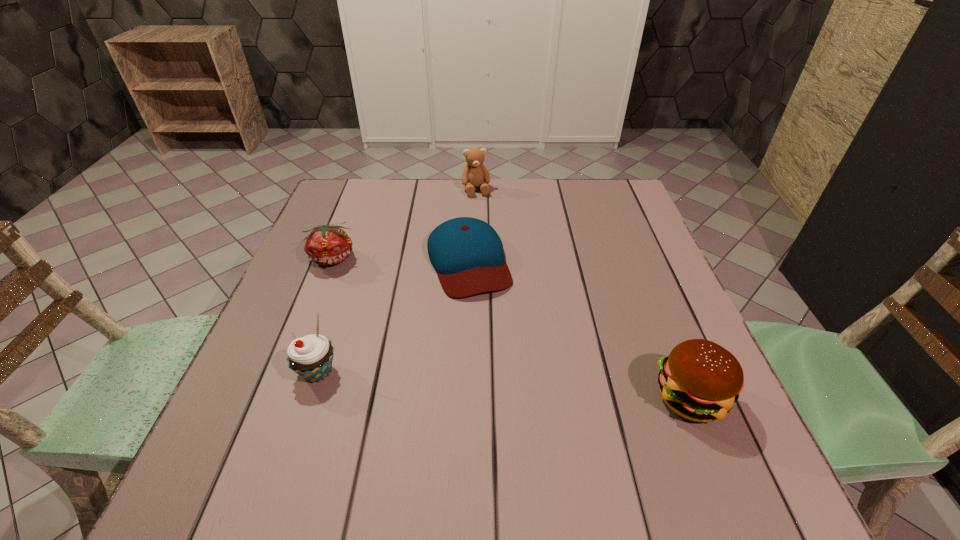
What are the coordinates of `vacant space located on the front-facing side of the tomato` in the screenshot? It's located at (422, 346).

Where is `free spot located 0.320m on the front-facing side of the tomato`? Image resolution: width=960 pixels, height=540 pixels. free spot located 0.320m on the front-facing side of the tomato is located at coordinates (422, 346).

Identify the location of free space located on the front-facing side of the tomato. This screenshot has height=540, width=960. (425, 348).

What are the coordinates of `vacant position located with the bill of the baseball cap facing forward` in the screenshot? It's located at (488, 318).

The image size is (960, 540). What are the coordinates of `vacant area situated 0.060m with the bill of the baseball cap facing forward` in the screenshot? It's located at (488, 318).

Find the location of a particular element. The image size is (960, 540). free location located 0.200m with the bill of the baseball cap facing forward is located at coordinates (508, 368).

The width and height of the screenshot is (960, 540). Identify the location of object situated at the far edge. (475, 174).

Image resolution: width=960 pixels, height=540 pixels. I want to click on object positioned at the near edge, so click(x=700, y=380).

Locate an element on the screen. The width and height of the screenshot is (960, 540). cupcake located in the left edge section of the desktop is located at coordinates (311, 356).

Identify the location of tomato positioned at the left edge. (326, 245).